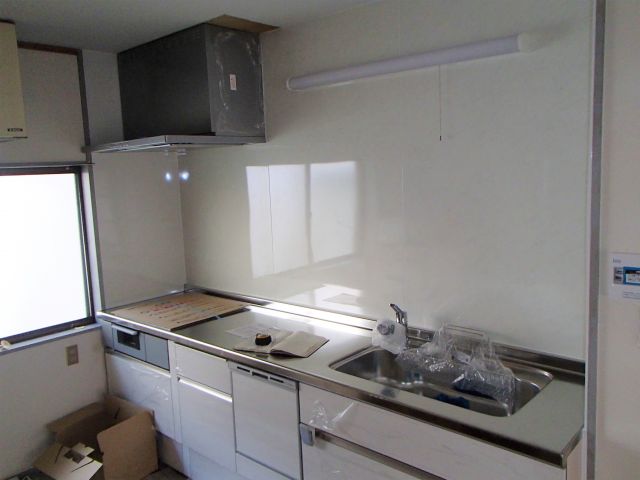
This screenshot has width=640, height=480. Identify the location of shiny kitchen walls. (483, 189), (118, 226).